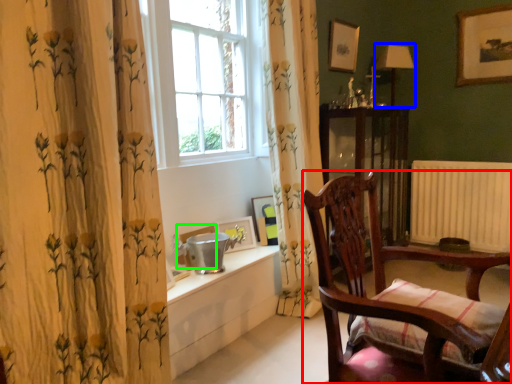
Question: Considering the real-world distances, which object is farthest from furniture (highlighted by a red box)? lamp (highlighted by a blue box) or picture frame (highlighted by a green box)?

Choices:
 (A) lamp
 (B) picture frame

Answer: (A)